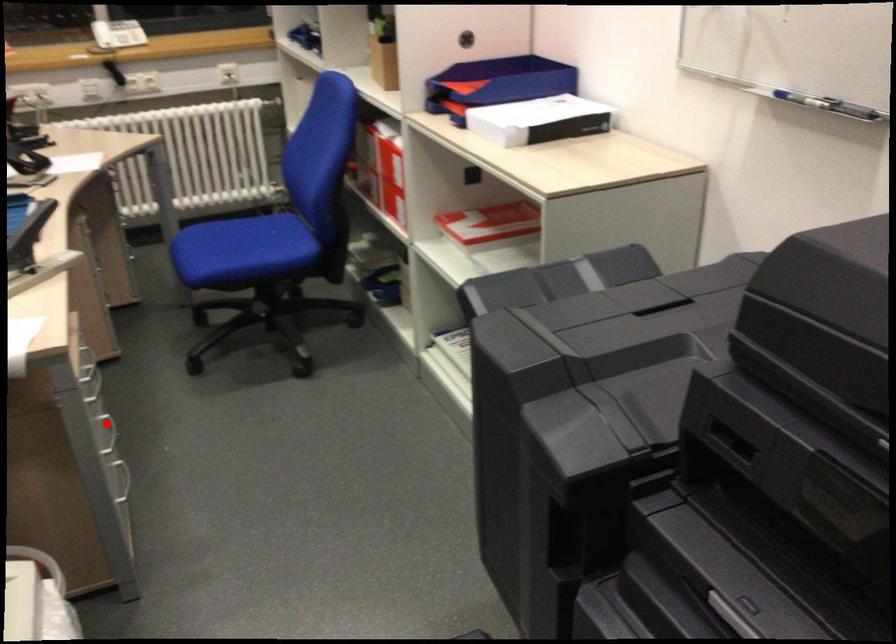
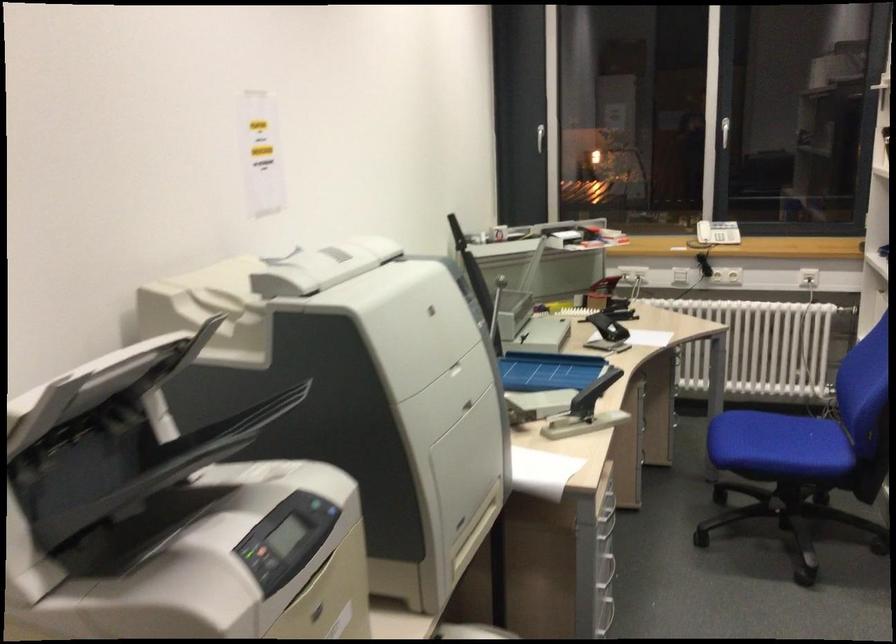
Where in the second image is the point corresponding to the highlighted location from the first image?

(604, 556)